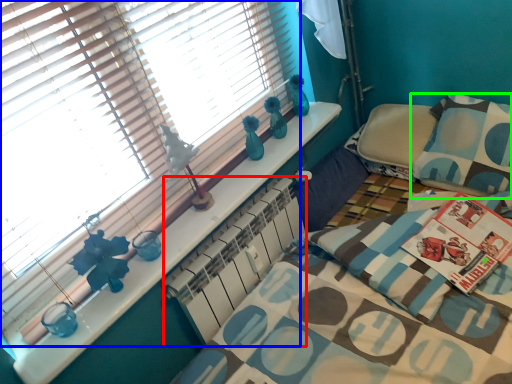
Question: Which is nearer to the radiator (highlighted by a red box)? window blind (highlighted by a blue box) or pillow (highlighted by a green box).

Choices:
 (A) window blind
 (B) pillow

Answer: (A)